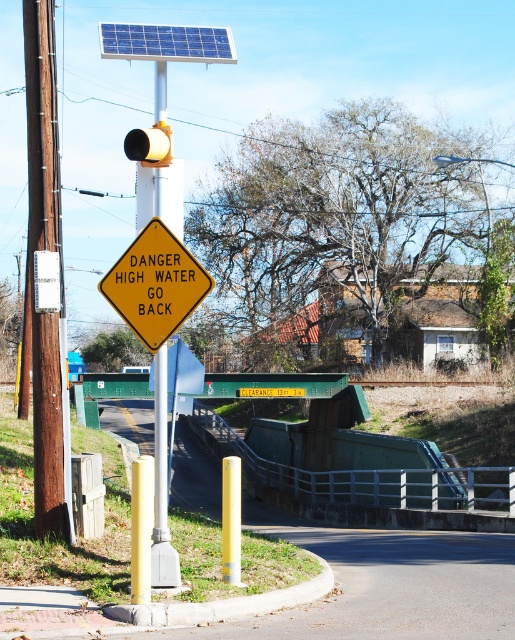
Between metallic yellow pole at center and blue textured solar panel at upper center, which one appears on the right side from the viewer's perspective?

Positioned to the right is blue textured solar panel at upper center.

The height and width of the screenshot is (640, 515). I want to click on metallic yellow pole at center, so click(162, 486).

This screenshot has width=515, height=640. I want to click on metallic yellow pole at center, so click(162, 486).

Between point (160, 342) and point (159, 426), which one is positioned in front?

Point (160, 342)

Is point (141, 301) farther from camera compared to point (163, 410)?

No, (141, 301) is in front of (163, 410).

You are a GUI agent. You are given a task and a screenshot of the screen. Output one action in this format:
    pyautogui.click(x=<x>, y=<y>)
    Task: Click on the yellow matte traffic sign at center
    
    Given the screenshot: What is the action you would take?
    pyautogui.click(x=156, y=284)

Between point (158, 278) and point (135, 32), which one is positioned behind?

The point (135, 32) is more distant.

Can you confirm if yellow matte traffic sign at center is smaller than blue textured solar panel at upper center?

Correct, yellow matte traffic sign at center occupies less space than blue textured solar panel at upper center.

At what (x,y) coordinates should I click in order to perform the action: click on yellow matte traffic sign at center. Please return your answer as a coordinate pair (x, y). Looking at the image, I should click on (156, 284).